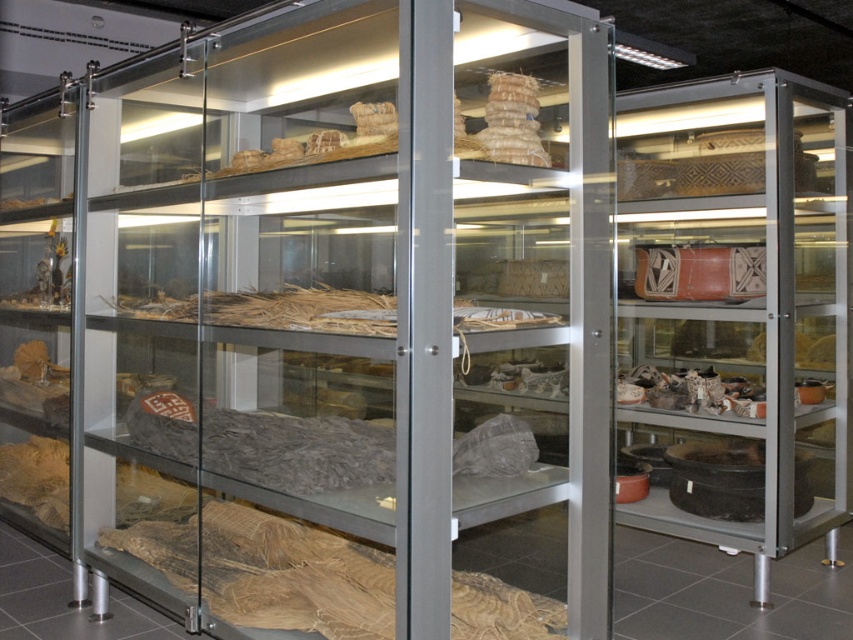
Question: Among these objects, which one is farthest from the camera?

Choices:
 (A) brown textured fabric at lower left
 (B) matte brown pottery at center right

Answer: (B)

Question: Does brown straw mat at center come in front of matte brown pottery at center right?

Choices:
 (A) yes
 (B) no

Answer: (A)

Question: In this image, where is clear glass shelf at center located relative to matte brown pottery at center right?

Choices:
 (A) right
 (B) left

Answer: (B)

Question: Which of the following is the closest to the observer?

Choices:
 (A) matte brown pottery at center right
 (B) brown straw mat at center

Answer: (B)

Question: Is matte ceramic bowls at right thinner than matte brown fabric at left?

Choices:
 (A) no
 (B) yes

Answer: (A)

Question: Which point is closer to the camera?

Choices:
 (A) matte ceramic bowls at right
 (B) woven straw basket at center
 (C) brown textured fabric at lower left

Answer: (B)